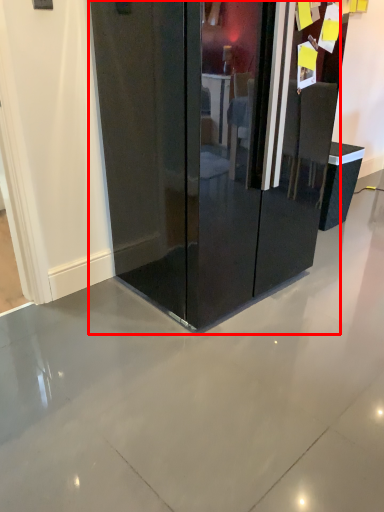
Question: From the image, what is the correct spatial relationship of glass door (annotated by the red box) in relation to furniture?

Choices:
 (A) right
 (B) left

Answer: (B)